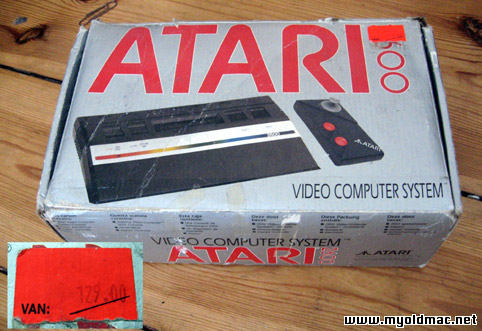
I want to click on box, so click(406, 167).